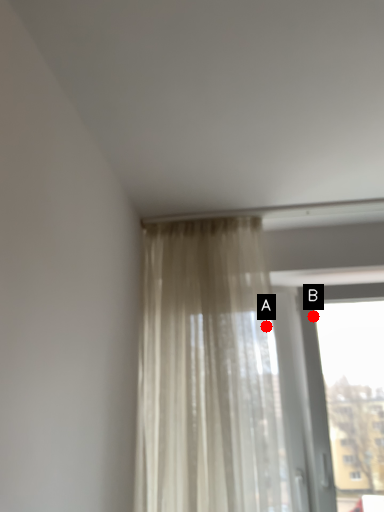
Question: Two points are circled on the image, labeled by A and B beside each circle. Which point is farther to the camera?

Choices:
 (A) A is further
 (B) B is further

Answer: (B)